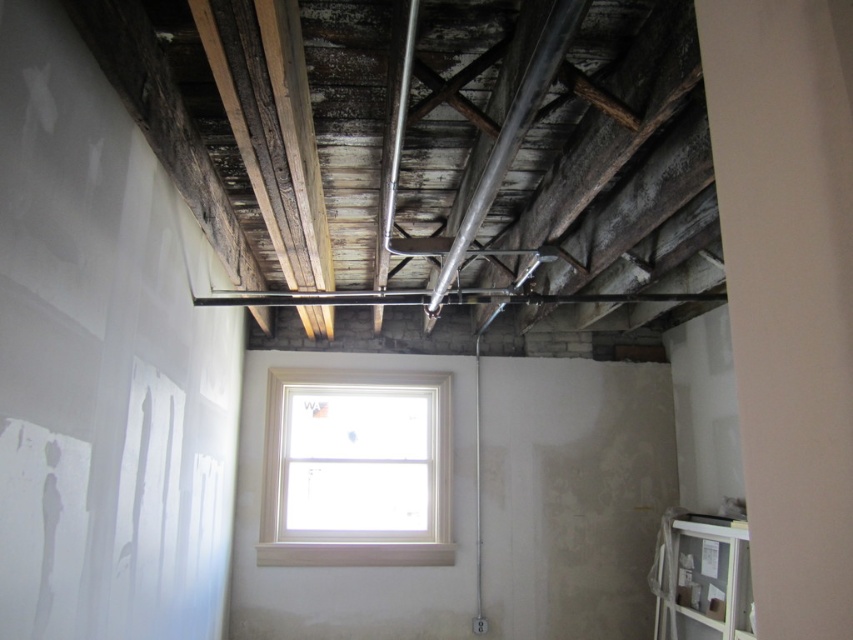
Between white painted wood window at center and metallic pipe at upper center, which one appears on the right side from the viewer's perspective?

Positioned to the right is metallic pipe at upper center.

Measure the distance from white painted wood window at center to metallic pipe at upper center.

They are 2.06 meters apart.

Where is `white painted wood window at center`? white painted wood window at center is located at coordinates (357, 468).

Which is behind, point (282, 380) or point (479, 620)?

The point (282, 380) is behind.

Does point (341, 372) come closer to viewer compared to point (476, 612)?

No, (341, 372) is further to viewer.

Locate an element on the screen. white painted wood window at center is located at coordinates (357, 468).

Between metallic pipe at upper center and matte silver pipe at center, which one has less height?

With less height is metallic pipe at upper center.

Can you confirm if metallic pipe at upper center is bigger than matte silver pipe at center?

Yes, metallic pipe at upper center is bigger than matte silver pipe at center.

Describe the element at coordinates (509, 134) in the screenshot. I see `metallic pipe at upper center` at that location.

Identify the location of metallic pipe at upper center. The image size is (853, 640). (509, 134).